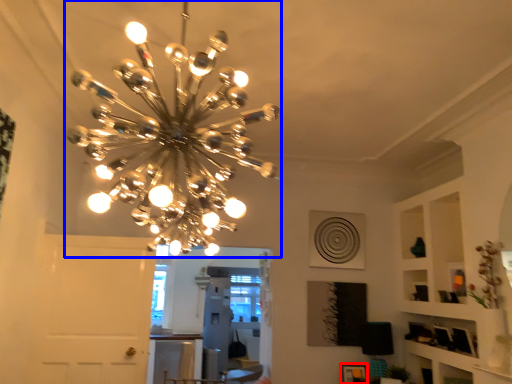
Question: Which point is further to the camera, picture frame (highlighted by a red box) or lamp (highlighted by a blue box)?

Choices:
 (A) picture frame
 (B) lamp

Answer: (A)